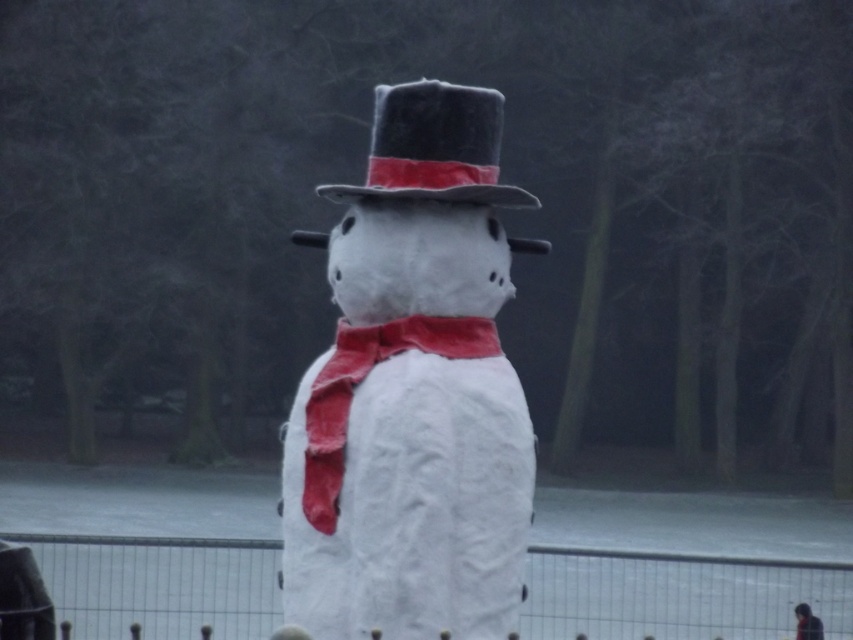
You are a photographer trying to capture the snowman and its accessories. You want to ensure both the white paper snowman at center and the red fabric bow tie at center are in the frame. Based on their positions, which object should you focus on first to ensure both are in the shot?

The white paper snowman at center is to the right of the red fabric bow tie at center. To ensure both are in the shot, focus on the red fabric bow tie at center first since it is on the left, allowing the camera to capture both objects as you adjust the frame to include the snowman on the right.